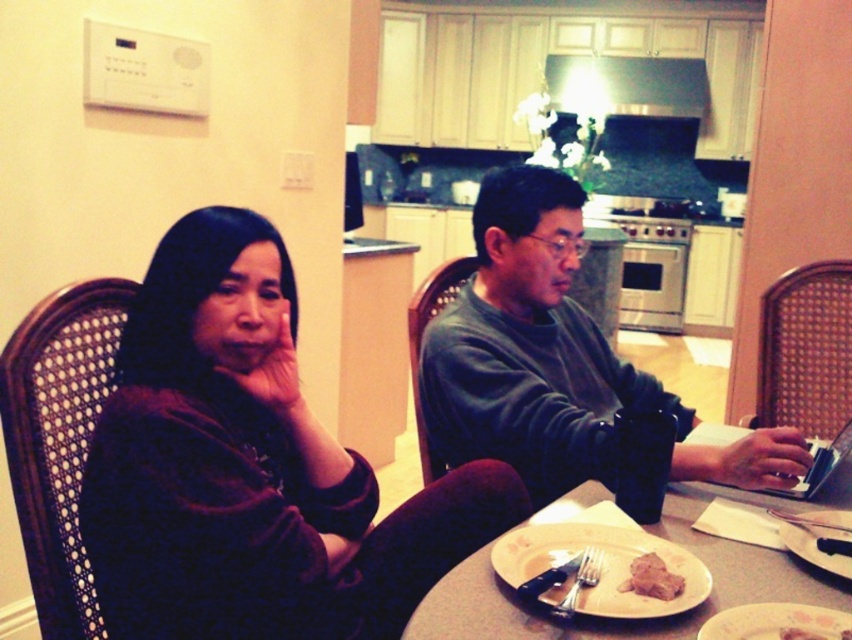
Question: Which object is farther from the camera taking this photo?

Choices:
 (A) dark brown sweater at center
 (B) white ceramic plate at lower right
 (C) brown matte meat at center
 (D) dark gray sweater at center

Answer: (D)

Question: Does white matte plate at lower center appear over brown matte meat at center?

Choices:
 (A) yes
 (B) no

Answer: (A)

Question: Considering the real-world distances, which object is closest to the white ceramic plate at lower right?

Choices:
 (A) white glossy plate at center
 (B) dark gray sweater at center
 (C) brown matte meat at center

Answer: (A)

Question: Is dark brown sweater at center closer to the viewer compared to white ceramic plate at lower right?

Choices:
 (A) no
 (B) yes

Answer: (A)

Question: Can you confirm if white ceramic plate at lower right is thinner than brown matte meat at center?

Choices:
 (A) yes
 (B) no

Answer: (B)

Question: Which of these objects is positioned farthest from the white glossy plate at center?

Choices:
 (A) dark gray sweater at center
 (B) white matte plate at lower center
 (C) white ceramic plate at lower right

Answer: (A)